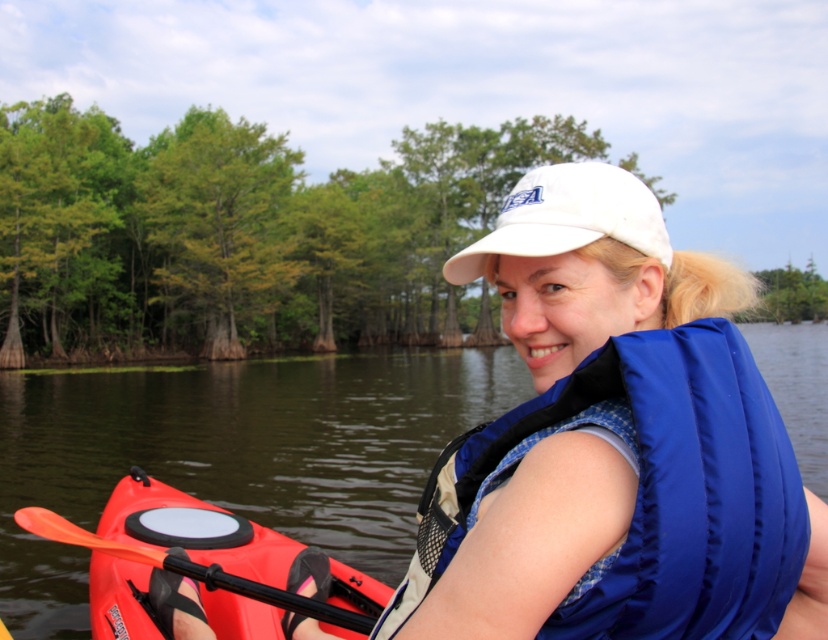
You are a safety inspector reviewing the kayak scene. The safety regulations require that the life jacket must be within arm reach of the person at all times. Given that the person is seated at the center of the kayak, can you confirm if the blue fabric life jacket at center is within arm reach based on its coordinates?

The blue fabric life jacket at center is located at point (650, 492), which is within arm reach of the person seated at the center of the kayak, so it meets the safety requirement.

You are standing on the shore of the lake and see two points marked on the kayak. The first point is at coordinates point (763, 413) and the second is at point (217, 576). Which point is closer to you?

Point (763, 413) is closer to the viewer than point (217, 576).

You are a photographer trying to capture the kayaker. You want to ensure both the blue fabric life jacket at center and the white fabric baseball cap at center are visible in your shot. Based on their positions, which object should you focus on first to frame the kayaker properly?

The blue fabric life jacket at center is to the left of the white fabric baseball cap at center, so you should focus on the blue fabric life jacket at center first to ensure both are in frame.